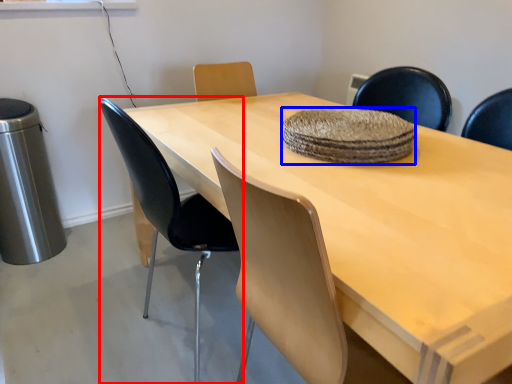
Question: Which object is closer to the camera taking this photo, chair (highlighted by a red box) or mat (highlighted by a blue box)?

Choices:
 (A) chair
 (B) mat

Answer: (A)